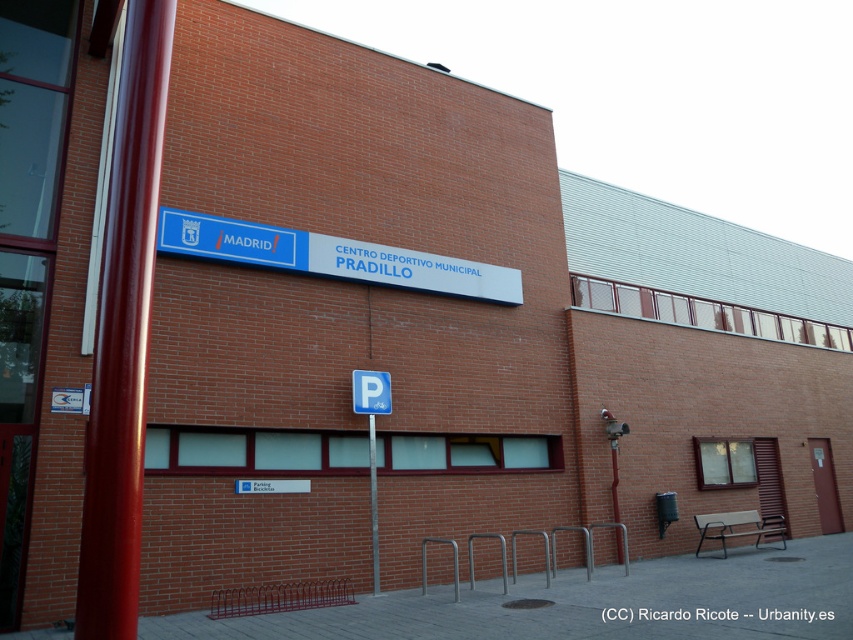
Which of these two, blue plastic sign at center or blue plastic parking sign at lower center, stands taller?

blue plastic sign at center is taller.

Where is `blue plastic sign at center`? blue plastic sign at center is located at coordinates (332, 257).

This screenshot has width=853, height=640. What do you see at coordinates (370, 392) in the screenshot?
I see `blue plastic parking sign at lower center` at bounding box center [370, 392].

Between point (364, 404) and point (374, 515), which one is positioned behind?

The point (364, 404) is more distant.

Find the location of a particular element. This screenshot has width=853, height=640. blue plastic parking sign at lower center is located at coordinates (370, 392).

Is blue plastic sign at center thinner than metallic pole at center?

In fact, blue plastic sign at center might be wider than metallic pole at center.

Who is taller, blue plastic sign at center or metallic pole at center?

metallic pole at center is taller.

Who is more forward, (463,262) or (370,486)?

Point (370,486) is in front.

Where is `blue plastic sign at center`? blue plastic sign at center is located at coordinates (332, 257).